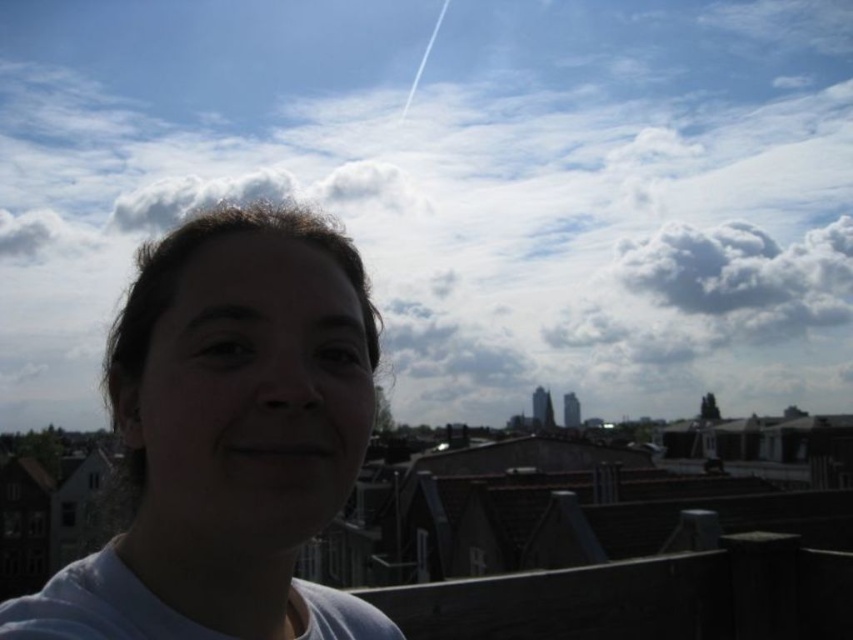
You are a photographer trying to capture the perfect selfie. You have two points marked on your screen at coordinates point (x=445, y=337) and point (x=247, y=422). Which point is closer to the camera?

Point (x=247, y=422) is closer to the camera because it is in front of point (x=445, y=337).

You are a photographer trying to capture a selfie with both the white fluffy cloud at upper center and the white matte face at center. Which object would appear wider in the photo?

The white fluffy cloud at upper center would appear wider in the photo since its width is larger than that of the white matte face at center.

You are a photographer trying to capture a selfie with a clear view of the sky. You notice the white fluffy cloud at upper center and the white matte face at center. Which object takes up more space in the photo?

The white fluffy cloud at upper center takes up more space in the photo because it is bigger than the white matte face at center.